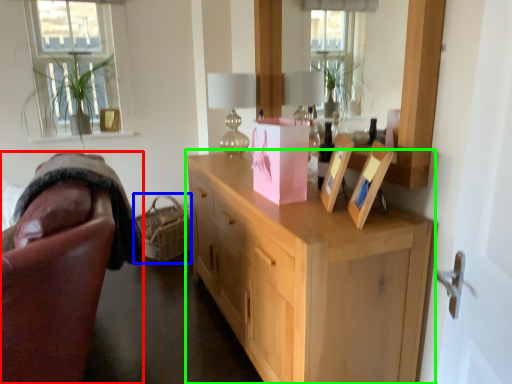
Question: Estimate the real-world distances between objects in this image. Which object is closer to chair (highlighted by a red box), basket (highlighted by a blue box) or cabinetry (highlighted by a green box)?

Choices:
 (A) basket
 (B) cabinetry

Answer: (B)